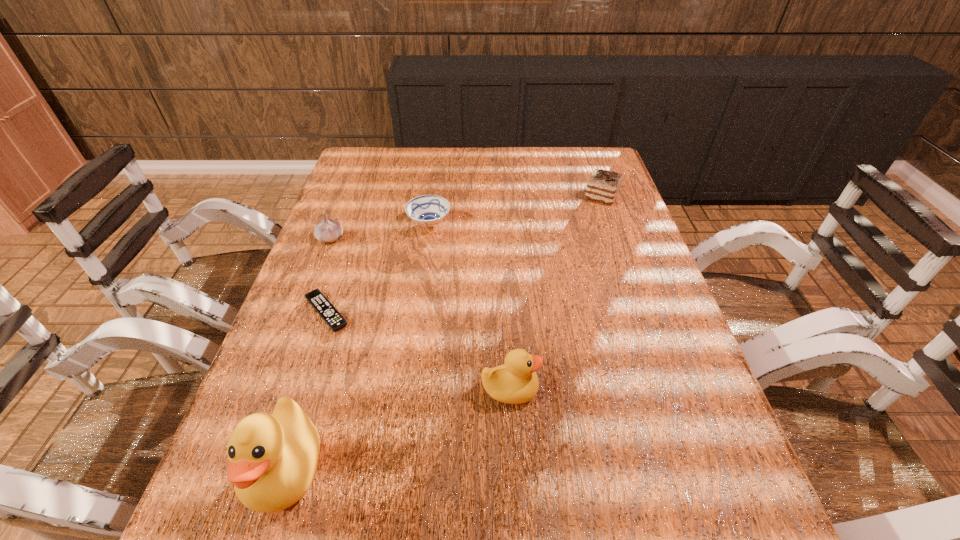
Please point a vacant point for placing a duck on the right. Please provide its 2D coordinates. Your answer should be formatted as a tuple, i.e. [(x, y)], where the tuple contains the x and y coordinates of a point satisfying the conditions above.

[(683, 329)]